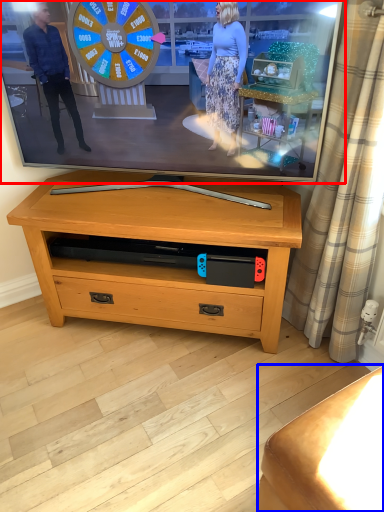
Question: Which point is further to the camera, television (highlighted by a red box) or furniture (highlighted by a blue box)?

Choices:
 (A) television
 (B) furniture

Answer: (A)